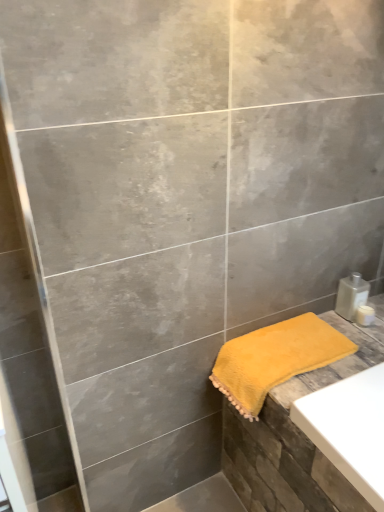
Question: Is yellow fluffy towel at lower right positioned beyond the bounds of clear plastic bottle at lower right?

Choices:
 (A) yes
 (B) no

Answer: (A)

Question: From a real-world perspective, is yellow fluffy towel at lower right under clear plastic bottle at lower right?

Choices:
 (A) yes
 (B) no

Answer: (A)

Question: Considering the relative sizes of yellow fluffy towel at lower right and clear plastic bottle at lower right in the image provided, is yellow fluffy towel at lower right shorter than clear plastic bottle at lower right?

Choices:
 (A) no
 (B) yes

Answer: (A)

Question: Is the position of yellow fluffy towel at lower right more distant than that of clear plastic bottle at lower right?

Choices:
 (A) no
 (B) yes

Answer: (A)

Question: Can you confirm if yellow fluffy towel at lower right is wider than clear plastic bottle at lower right?

Choices:
 (A) no
 (B) yes

Answer: (B)

Question: From a real-world perspective, is clear plastic bottle at lower right above or below white plastic container at right?

Choices:
 (A) above
 (B) below

Answer: (A)

Question: Considering the positions of clear plastic bottle at lower right and white plastic container at right in the image, is clear plastic bottle at lower right bigger or smaller than white plastic container at right?

Choices:
 (A) small
 (B) big

Answer: (B)

Question: In terms of height, does clear plastic bottle at lower right look taller or shorter compared to white plastic container at right?

Choices:
 (A) tall
 (B) short

Answer: (A)

Question: Relative to white plastic container at right, is clear plastic bottle at lower right in front or behind?

Choices:
 (A) behind
 (B) front

Answer: (B)

Question: From the image's perspective, relative to yellow fluffy towel at lower right, is white plastic container at right above or below?

Choices:
 (A) above
 (B) below

Answer: (A)

Question: Is white plastic container at right wider or thinner than yellow fluffy towel at lower right?

Choices:
 (A) wide
 (B) thin

Answer: (B)

Question: From a real-world perspective, is white plastic container at right physically located above or below yellow fluffy towel at lower right?

Choices:
 (A) below
 (B) above

Answer: (B)

Question: Considering their positions, is white plastic container at right located in front of or behind yellow fluffy towel at lower right?

Choices:
 (A) front
 (B) behind

Answer: (B)

Question: In terms of width, does white plastic container at right look wider or thinner when compared to clear plastic bottle at lower right?

Choices:
 (A) wide
 (B) thin

Answer: (B)

Question: In terms of size, does white plastic container at right appear bigger or smaller than clear plastic bottle at lower right?

Choices:
 (A) small
 (B) big

Answer: (A)